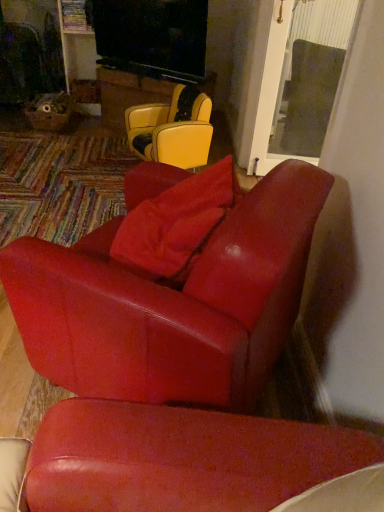
Question: From a real-world perspective, is leather yellow chair at center, the 2th chair positioned from the bottom, physically located above or below matte red leather chair at center, which appears as the 1th chair when viewed from the front?

Choices:
 (A) above
 (B) below

Answer: (B)

Question: In the image, is leather yellow chair at center, the 2th chair positioned from the bottom, positioned in front of or behind matte red leather chair at center, which appears as the 1th chair when viewed from the front?

Choices:
 (A) front
 (B) behind

Answer: (B)

Question: Estimate the real-world distances between objects in this image. Which object is closer to the transparent glass door at upper right?

Choices:
 (A) leather yellow chair at center, the 2th chair positioned from the bottom
 (B) satin red pillow at center
 (C) matte red leather chair at center, acting as the 1th chair starting from the bottom

Answer: (A)

Question: Which of these objects is positioned farthest from the leather yellow chair at center, the 2th chair positioned from the bottom?

Choices:
 (A) matte red leather chair at center, acting as the 1th chair starting from the bottom
 (B) transparent glass door at upper right
 (C) satin red pillow at center

Answer: (A)